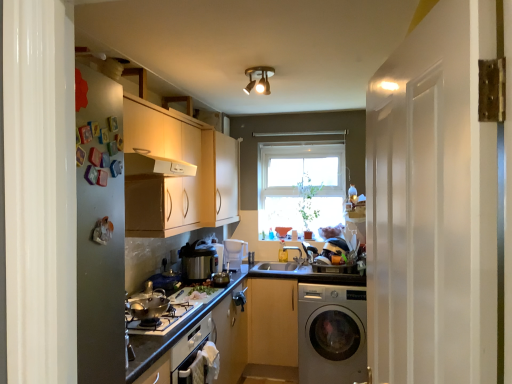
Question: From their relative heights in the image, would you say clear glass window at center is taller or shorter than light wood cabinet at center, the first cabinetry in the bottom-to-top sequence?

Choices:
 (A) tall
 (B) short

Answer: (A)

Question: From the image's perspective, is clear glass window at center above or below light wood cabinet at center, arranged as the 1th cabinetry when viewed from the right?

Choices:
 (A) below
 (B) above

Answer: (B)

Question: Which is farther from the clear glass window at center?

Choices:
 (A) satin silver rice cooker at center, positioned as the second appliance in back-to-front order
 (B) metallic silver rice cooker at center, the 3th appliance in the back-to-front sequence
 (C) brass/bronze finish spotlight at upper center
 (D) white glossy door at right
 (E) light wood cabinet at center, positioned as the second cabinetry in left-to-right order

Answer: (D)

Question: Which object is the farthest from the metallic silver rice cooker at center, placed as the second appliance when sorted from front to back?

Choices:
 (A) white plastic container at center, which is counted as the 1th appliance, starting from the back
 (B) light wood cabinet at center, arranged as the 1th cabinetry when viewed from the right
 (C) clear glass window at center
 (D) black plastic door handle at lower center
 (E) shiny silver pot at lower left, positioned as the 4th appliance in back-to-front order

Answer: (C)